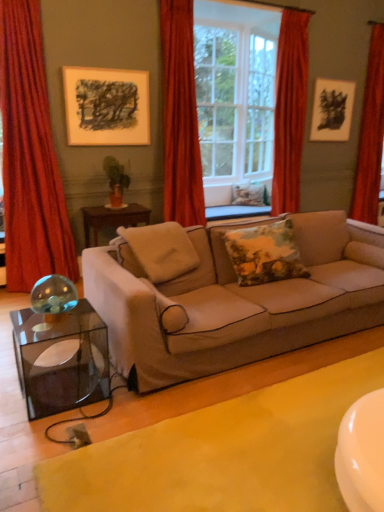
Locate an element on the screen. free space above yellow fabric at lower center (from a real-world perspective) is located at coordinates (249, 440).